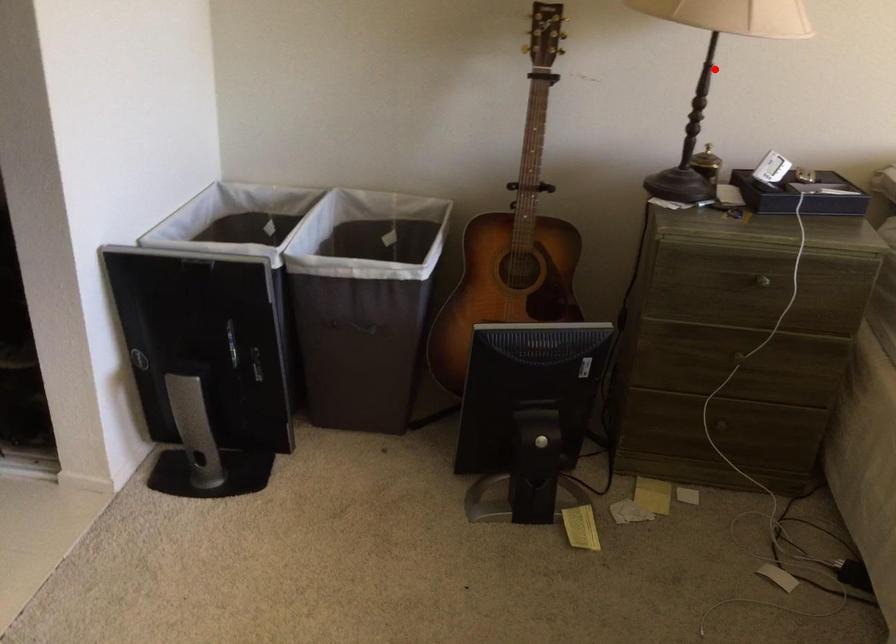
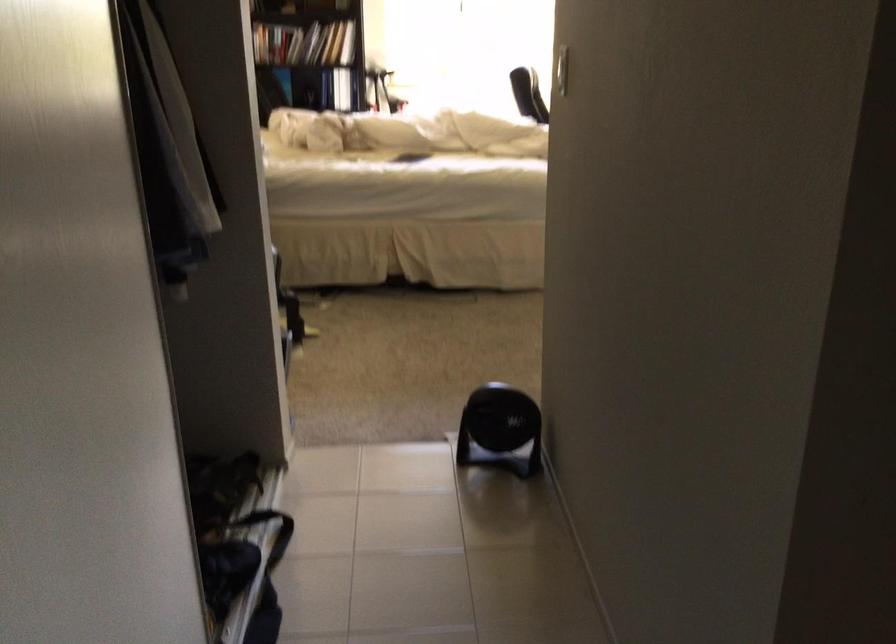
Question: I am providing you with two images of the same scene from different viewpoints. A red point is marked on the first image. Is the red point's position out of view in image 2?

Choices:
 (A) Yes
 (B) No

Answer: (A)